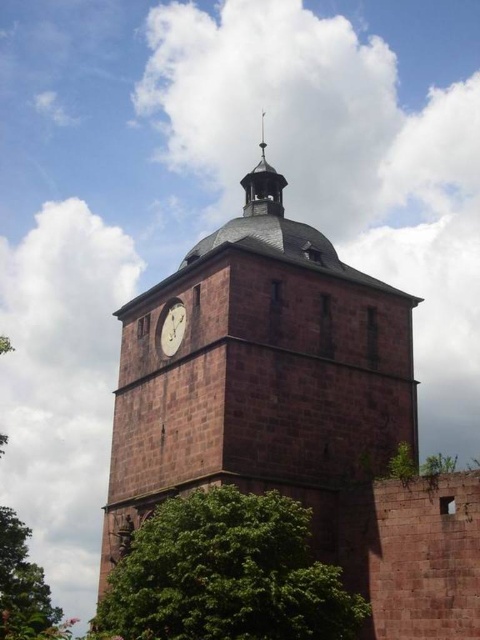
Is red brick clock tower at center wider than white glossy clock at center?

Yes, red brick clock tower at center is wider than white glossy clock at center.

Does red brick clock tower at center appear on the right side of white glossy clock at center?

Indeed, red brick clock tower at center is positioned on the right side of white glossy clock at center.

Is point (385, 497) less distant than point (180, 324)?

That is True.

Where is `red brick clock tower at center`? This screenshot has width=480, height=640. red brick clock tower at center is located at coordinates (294, 413).

Is point (269, 538) closer to camera compared to point (181, 332)?

Yes, it is in front of point (181, 332).

I want to click on green leafy tree at lower center, so click(x=226, y=573).

The width and height of the screenshot is (480, 640). Find the location of `green leafy tree at lower center`. green leafy tree at lower center is located at coordinates tap(226, 573).

Which is behind, point (251, 305) or point (15, 593)?

The point (15, 593) is more distant.

Between red brick clock tower at center and green leafy tree at left, which one has less height?

With less height is red brick clock tower at center.

Is point (172, 424) in front of point (14, 632)?

No, it is not.

The width and height of the screenshot is (480, 640). I want to click on red brick clock tower at center, so click(294, 413).